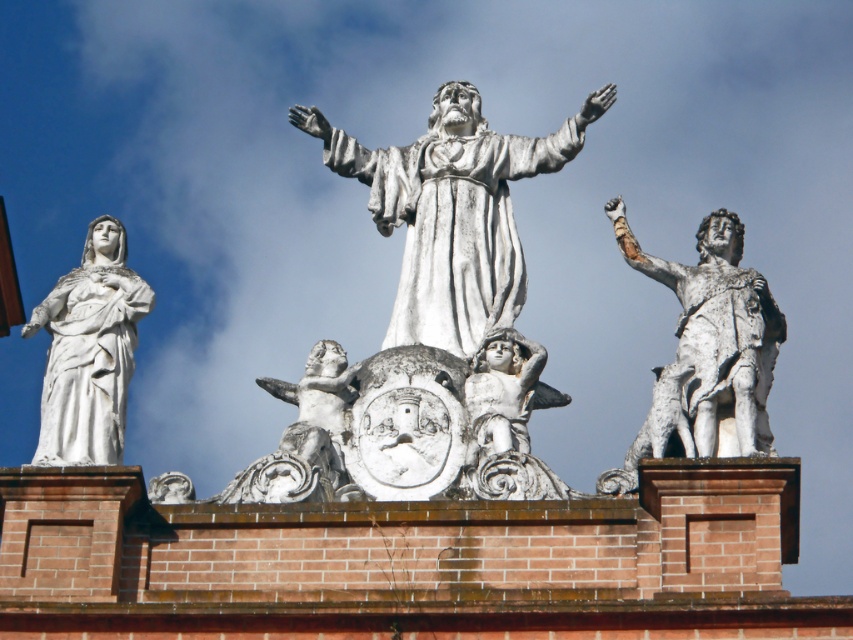
Question: Can you confirm if white marble statue at center is bigger than white marble cherub at center?

Choices:
 (A) yes
 (B) no

Answer: (A)

Question: Which point is closer to the camera?

Choices:
 (A) white marble statue at center
 (B) white marble statue at left
 (C) silver metallic warrior at right
 (D) white marble cherub at center

Answer: (C)

Question: Where is white marble statue at center located in relation to silver metallic warrior at right in the image?

Choices:
 (A) left
 (B) right

Answer: (A)

Question: Where is white marble statue at center located in relation to silver metallic warrior at right in the image?

Choices:
 (A) right
 (B) left

Answer: (B)

Question: Which object is positioned farthest from the white marble cherub at center?

Choices:
 (A) white marble statue at center
 (B) silver metallic warrior at right

Answer: (A)

Question: Which object is closer to the camera taking this photo?

Choices:
 (A) white marble cherub at center
 (B) silver metallic warrior at right

Answer: (B)